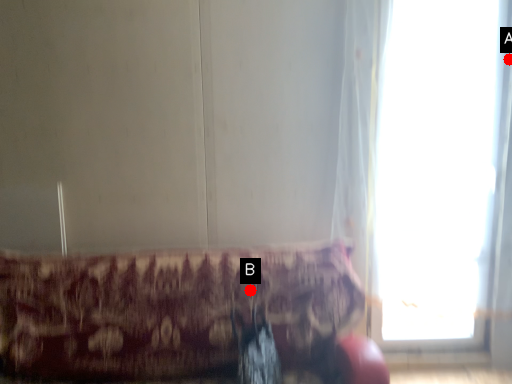
Question: Two points are circled on the image, labeled by A and B beside each circle. Which of the following is the closest to the observer?

Choices:
 (A) A is closer
 (B) B is closer

Answer: (B)